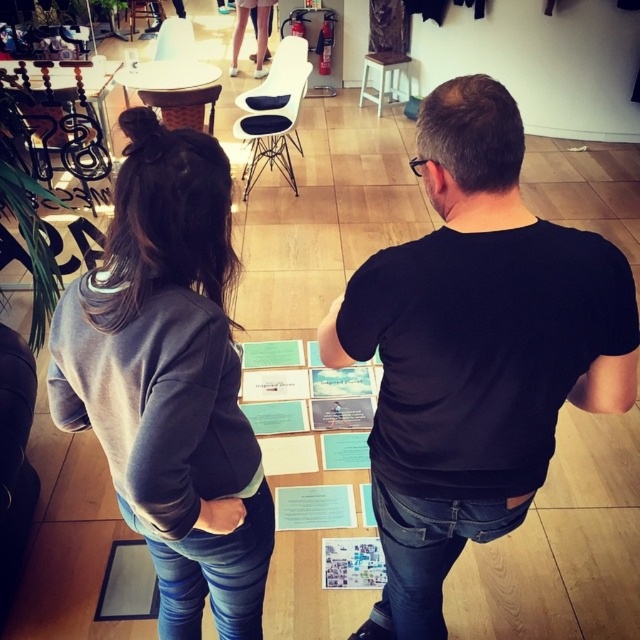
You are standing in the open area and want to pick up the item at point (x=365, y=58). Which direction should you move relative to the item at point (x=513, y=113)?

You should move away from the item at point (x=513, y=113) because point (x=365, y=58) is further from the camera compared to point (x=513, y=113).

You are a photographer setting up a shoot in this space. You need to position a tripod between the black matte shirt at center and the white plastic stool at upper center. Based on their positions, where should the tripod be placed?

The tripod should be placed between the black matte shirt at center and the white plastic stool at upper center. Since the black matte shirt at center is located below the white plastic stool at upper center, the tripod can be set up in the space between them along the vertical axis.